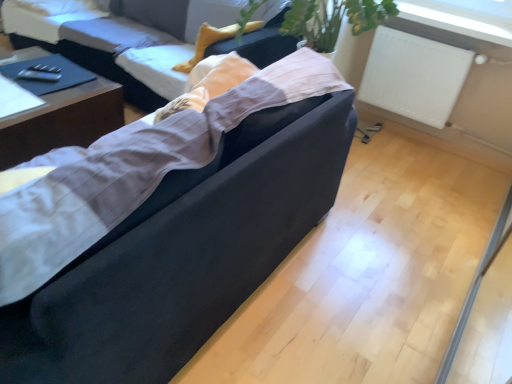
Question: Does suede-like black couch at center, the second studio couch viewed from the back, have a lesser width compared to white matte radiator at upper right?

Choices:
 (A) yes
 (B) no

Answer: (B)

Question: Is suede-like black couch at center, the second studio couch viewed from the back, not near white matte radiator at upper right?

Choices:
 (A) no
 (B) yes

Answer: (B)

Question: Does suede-like black couch at center, the first studio couch positioned from the front, touch white matte radiator at upper right?

Choices:
 (A) no
 (B) yes

Answer: (A)

Question: From a real-world perspective, is suede-like black couch at center, the second studio couch viewed from the back, under white matte radiator at upper right?

Choices:
 (A) yes
 (B) no

Answer: (B)

Question: Does suede-like black couch at center, the first studio couch positioned from the front, have a larger size compared to white matte radiator at upper right?

Choices:
 (A) no
 (B) yes

Answer: (B)

Question: In terms of width, does dark wood table at left look wider or thinner when compared to white matte radiator at upper right?

Choices:
 (A) wide
 (B) thin

Answer: (A)

Question: Considering the relative positions of dark wood table at left and white matte radiator at upper right in the image provided, is dark wood table at left to the left or to the right of white matte radiator at upper right?

Choices:
 (A) left
 (B) right

Answer: (A)

Question: From the image's perspective, is dark wood table at left above or below white matte radiator at upper right?

Choices:
 (A) above
 (B) below

Answer: (B)

Question: From their relative heights in the image, would you say dark wood table at left is taller or shorter than white matte radiator at upper right?

Choices:
 (A) short
 (B) tall

Answer: (A)

Question: Would you say white matte radiator at upper right is inside or outside suede-like black couch at center, the first studio couch positioned from the front?

Choices:
 (A) inside
 (B) outside

Answer: (B)

Question: Is white matte radiator at upper right in front of or behind suede-like black couch at center, the first studio couch positioned from the front, in the image?

Choices:
 (A) behind
 (B) front

Answer: (A)

Question: Considering the positions of white matte radiator at upper right and suede-like black couch at center, the second studio couch viewed from the back, in the image, is white matte radiator at upper right wider or thinner than suede-like black couch at center, the second studio couch viewed from the back,?

Choices:
 (A) wide
 (B) thin

Answer: (B)

Question: Considering the positions of white matte radiator at upper right and suede-like black couch at center, the second studio couch viewed from the back, in the image, is white matte radiator at upper right bigger or smaller than suede-like black couch at center, the second studio couch viewed from the back,?

Choices:
 (A) big
 (B) small

Answer: (B)

Question: From the image's perspective, is velvet black couch at center, positioned as the second studio couch in front-to-back order, above or below suede-like black couch at center, the second studio couch viewed from the back?

Choices:
 (A) above
 (B) below

Answer: (A)

Question: Is velvet black couch at center, positioned as the second studio couch in front-to-back order, inside the boundaries of suede-like black couch at center, the first studio couch positioned from the front, or outside?

Choices:
 (A) outside
 (B) inside

Answer: (A)